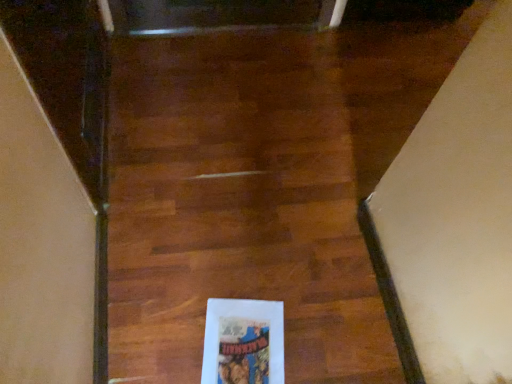
What do you see at coordinates (232, 210) in the screenshot? Image resolution: width=512 pixels, height=384 pixels. I see `wooden floor at center` at bounding box center [232, 210].

This screenshot has width=512, height=384. Find the location of `wooden floor at center`. wooden floor at center is located at coordinates (232, 210).

Find the location of a particular element. wooden floor at center is located at coordinates (232, 210).